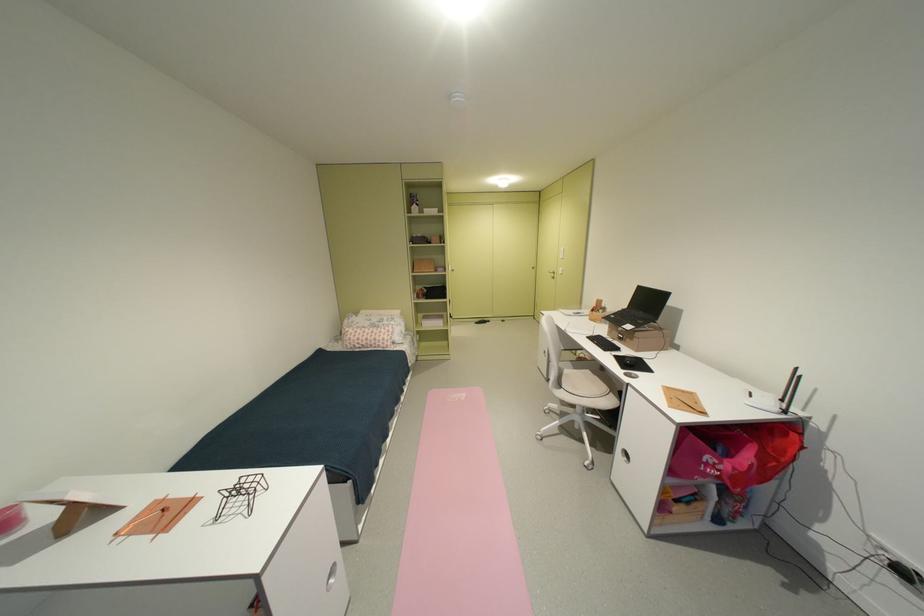
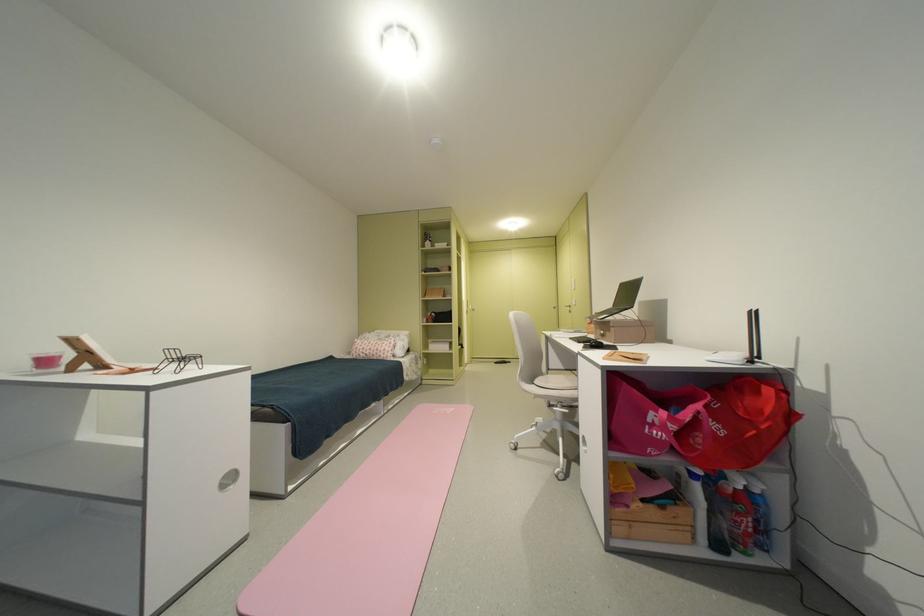
In the second image, find the point that corresponds to [720,472] in the first image.

(665, 432)